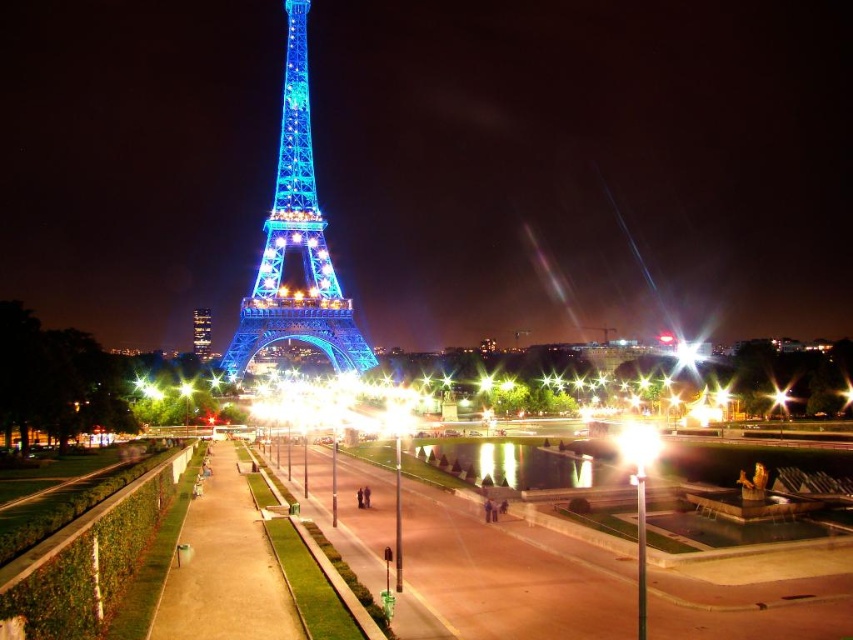
Question: Which point is farther to the camera?

Choices:
 (A) shiny metallic tower at center
 (B) shiny blue metal eiffel tower at center

Answer: (A)

Question: Can you confirm if shiny blue metal eiffel tower at center is positioned to the right of shiny metallic tower at center?

Choices:
 (A) yes
 (B) no

Answer: (A)

Question: Is shiny blue metal eiffel tower at center to the left of shiny metallic tower at center from the viewer's perspective?

Choices:
 (A) yes
 (B) no

Answer: (B)

Question: Which of the following is the farthest from the observer?

Choices:
 (A) (196, 312)
 (B) (277, 259)

Answer: (A)

Question: Considering the relative positions of shiny blue metal eiffel tower at center and shiny metallic tower at center in the image provided, where is shiny blue metal eiffel tower at center located with respect to shiny metallic tower at center?

Choices:
 (A) left
 (B) right

Answer: (B)

Question: Which of the following is the closest to the observer?

Choices:
 (A) (198, 316)
 (B) (277, 243)

Answer: (B)